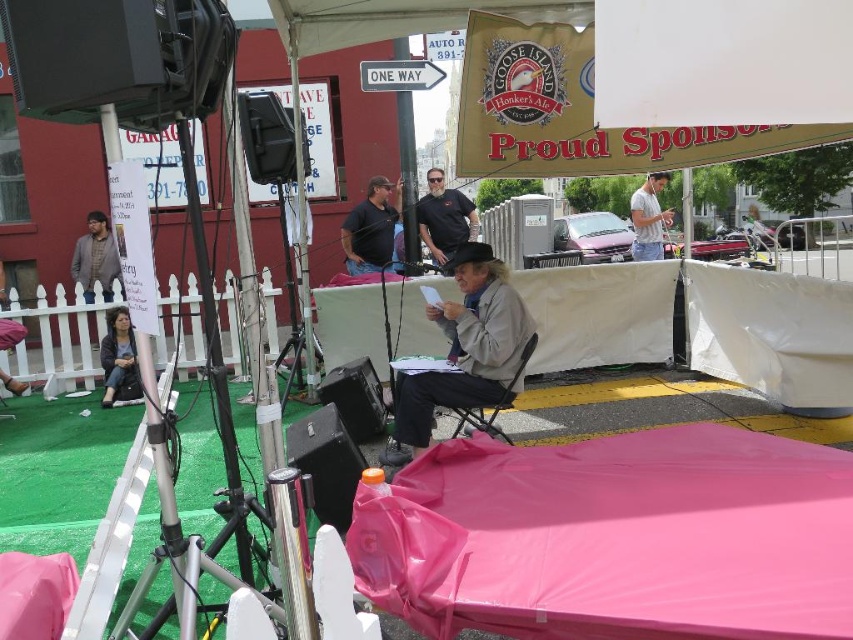
You are standing at the event and want to place a small decoration between the two points marked as point (384, 225) and point (438, 182). Which point is closer to you where you should start placing the decoration?

Point (384, 225) is closer to the viewer than point (438, 182), so you should start placing the decoration near point (384, 225).

You are at the outdoor event and want to move from the point at coordinates point (460,241) to the point at coordinates point (514,376). Can you walk directly between them without going around?

Point (460,241) is behind point (514,376), so you cannot walk directly between them without going around.